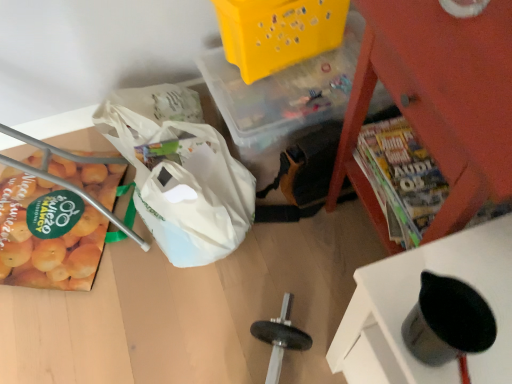
Question: From the image's perspective, is yellow matte oranges at left located beneath metallic red magazine rack at upper right, arranged as the first furniture when viewed from the back?

Choices:
 (A) no
 (B) yes

Answer: (B)

Question: Considering the relative positions of yellow matte oranges at left and metallic red magazine rack at upper right, arranged as the first furniture when viewed from the back, in the image provided, is yellow matte oranges at left to the right of metallic red magazine rack at upper right, arranged as the first furniture when viewed from the back, from the viewer's perspective?

Choices:
 (A) yes
 (B) no

Answer: (B)

Question: From a real-world perspective, is yellow matte oranges at left physically below metallic red magazine rack at upper right, arranged as the first furniture when viewed from the back?

Choices:
 (A) no
 (B) yes

Answer: (B)

Question: Is yellow matte oranges at left touching metallic red magazine rack at upper right, arranged as the first furniture when viewed from the back?

Choices:
 (A) yes
 (B) no

Answer: (B)

Question: Is yellow matte oranges at left bigger than metallic red magazine rack at upper right, the second furniture positioned from the front?

Choices:
 (A) yes
 (B) no

Answer: (B)

Question: Is point (4, 173) closer or farther from the camera than point (242, 215)?

Choices:
 (A) closer
 (B) farther

Answer: (B)

Question: Is yellow matte oranges at left in front of or behind white plastic grocery bag at lower left in the image?

Choices:
 (A) front
 (B) behind

Answer: (B)

Question: Is yellow matte oranges at left taller or shorter than white plastic grocery bag at lower left?

Choices:
 (A) short
 (B) tall

Answer: (A)

Question: Is yellow matte oranges at left wider or thinner than white plastic grocery bag at lower left?

Choices:
 (A) wide
 (B) thin

Answer: (A)

Question: Relative to metallic red magazine rack at upper right, the second furniture positioned from the front, is yellow matte oranges at left in front or behind?

Choices:
 (A) front
 (B) behind

Answer: (B)

Question: Does point (105, 200) appear closer or farther from the camera than point (444, 233)?

Choices:
 (A) closer
 (B) farther

Answer: (B)

Question: Visually, is yellow matte oranges at left positioned to the left or to the right of metallic red magazine rack at upper right, arranged as the first furniture when viewed from the back?

Choices:
 (A) left
 (B) right

Answer: (A)

Question: Choose the correct answer: Is yellow matte oranges at left inside metallic red magazine rack at upper right, arranged as the first furniture when viewed from the back, or outside it?

Choices:
 (A) inside
 (B) outside

Answer: (B)

Question: From the image's perspective, relative to metallic red magazine rack at upper right, the second furniture positioned from the front, is white plastic grocery bag at lower left above or below?

Choices:
 (A) below
 (B) above

Answer: (A)

Question: Considering the positions of point (206, 168) and point (462, 66), is point (206, 168) closer or farther from the camera than point (462, 66)?

Choices:
 (A) farther
 (B) closer

Answer: (A)